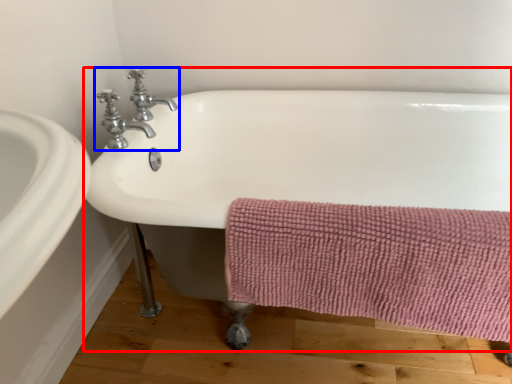
Question: Which object is closer to the camera taking this photo, bathtub (highlighted by a red box) or tap (highlighted by a blue box)?

Choices:
 (A) bathtub
 (B) tap

Answer: (A)